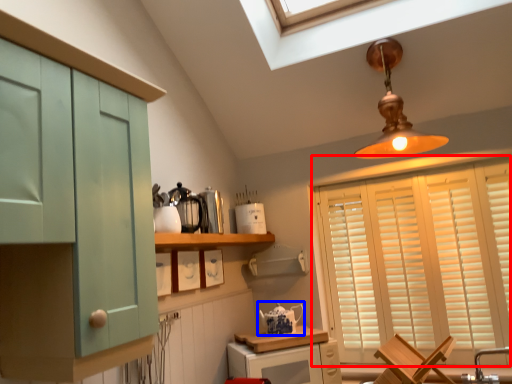
Question: Which of the following is the closest to the observer, window (highlighted by a red box) or tea pot (highlighted by a blue box)?

Choices:
 (A) window
 (B) tea pot

Answer: (A)